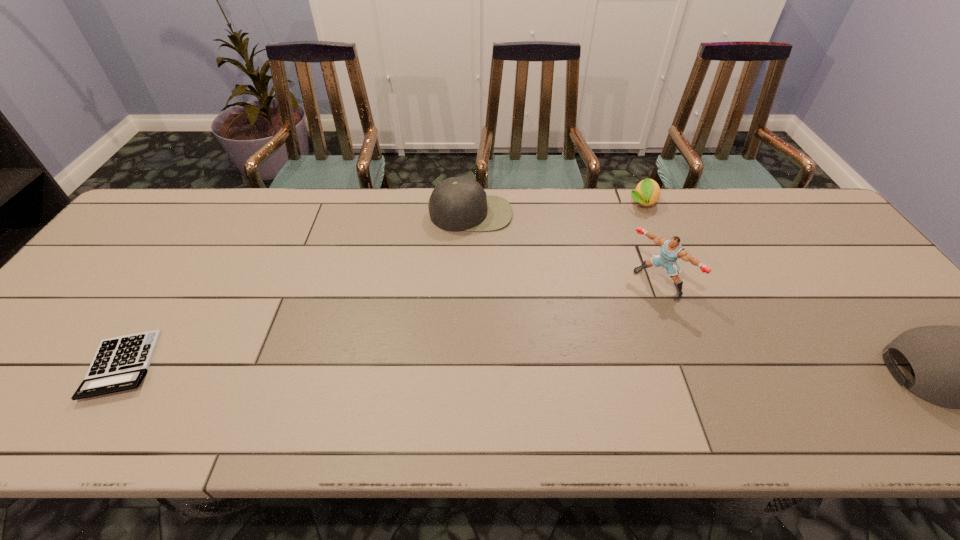
Where is `object that is at the near left corner`? This screenshot has height=540, width=960. object that is at the near left corner is located at coordinates (120, 363).

This screenshot has width=960, height=540. In the image, there is a desktop. What are the coordinates of `vacant space at the far edge` in the screenshot? It's located at (379, 197).

In the image, there is a desktop. Identify the location of blank space at the near edge. (818, 361).

Image resolution: width=960 pixels, height=540 pixels. What are the coordinates of `vacant space at the left edge of the desktop` in the screenshot? It's located at (58, 331).

This screenshot has width=960, height=540. Find the location of `vacant region at the right edge of the desktop`. vacant region at the right edge of the desktop is located at coordinates (834, 299).

Locate an element on the screen. This screenshot has height=540, width=960. free space between the leftmost object and the fourth object from right to left is located at coordinates (296, 289).

Locate an element on the screen. This screenshot has height=540, width=960. free space between the third farthest object and the lemon is located at coordinates (650, 243).

The width and height of the screenshot is (960, 540). Find the location of `empty location between the second object from left to right and the lemon`. empty location between the second object from left to right and the lemon is located at coordinates (557, 208).

Find the location of a particular element. This screenshot has width=960, height=540. vacant space in between the second shortest object and the tallest object is located at coordinates (650, 243).

This screenshot has height=540, width=960. I want to click on free space between the lemon and the second object from left to right, so click(557, 208).